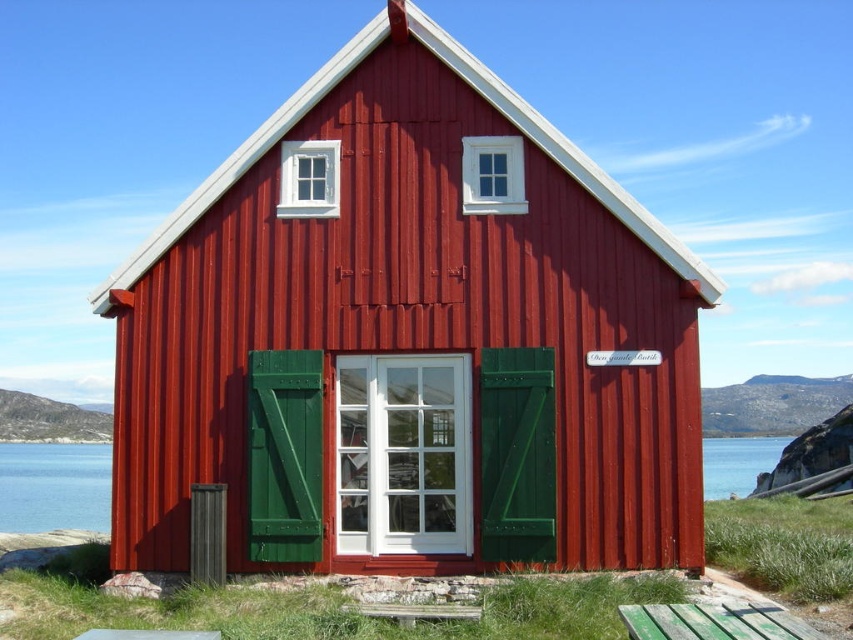
Question: Among these objects, which one is farthest from the camera?

Choices:
 (A) smooth wooden hut at center
 (B) green weathered wood picnic table at lower right

Answer: (A)

Question: Among these objects, which one is farthest from the camera?

Choices:
 (A) transparent glass water at lower center
 (B) smooth wooden hut at center

Answer: (A)

Question: Does smooth wooden hut at center have a smaller size compared to transparent glass water at lower center?

Choices:
 (A) no
 (B) yes

Answer: (B)

Question: Can you confirm if smooth wooden hut at center is thinner than green weathered wood picnic table at lower right?

Choices:
 (A) yes
 (B) no

Answer: (A)

Question: Which of the following is the farthest from the observer?

Choices:
 (A) tap(4, 467)
 (B) tap(724, 630)

Answer: (A)

Question: Is smooth wooden hut at center behind green weathered wood picnic table at lower right?

Choices:
 (A) yes
 (B) no

Answer: (A)